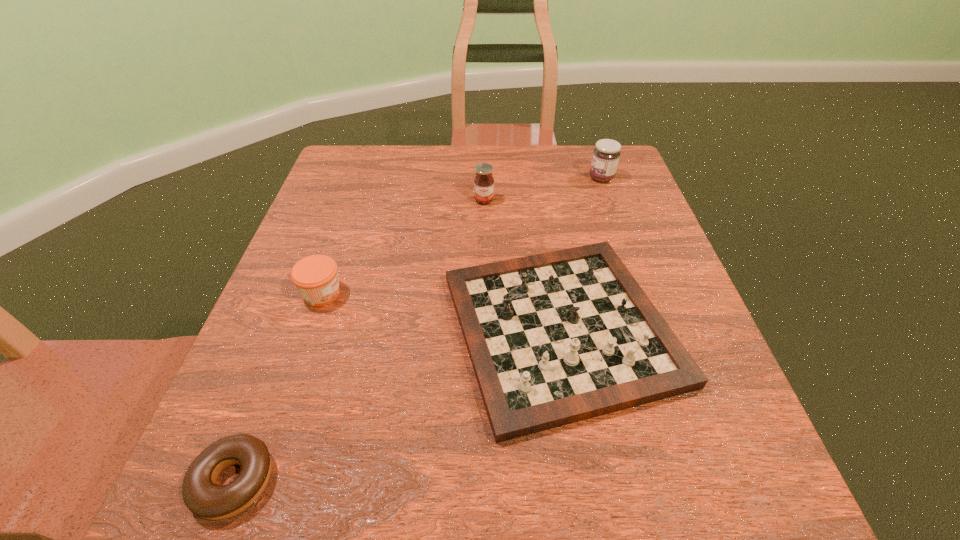
Identify which jam is the third nearest to the chessboard. Please provide its 2D coordinates. Your answer should be formatted as a tuple, i.e. [(x, y)], where the tuple contains the x and y coordinates of a point satisfying the conditions above.

[(606, 154)]

In order to click on blank area in the image that satisfies the following two spatial constraints: 1. on the front label of the leftmost jam; 2. on the right side of the chessboard in this screenshot , I will do `click(310, 329)`.

In order to click on vacant space that satisfies the following two spatial constraints: 1. on the label side of the chessboard; 2. on the right side of the second jam from left to right in this screenshot , I will do `click(486, 329)`.

Where is `free space that satisfies the following two spatial constraints: 1. on the label side of the fourth nearest object; 2. on the front label of the shortest jam`? free space that satisfies the following two spatial constraints: 1. on the label side of the fourth nearest object; 2. on the front label of the shortest jam is located at coordinates (485, 294).

Identify the location of free location that satisfies the following two spatial constraints: 1. on the front label of the farthest jam; 2. on the label side of the second farthest jam. The image size is (960, 540). (610, 200).

This screenshot has height=540, width=960. I want to click on free space in the image that satisfies the following two spatial constraints: 1. on the front label of the nearest jam; 2. on the right side of the chessboard, so click(310, 329).